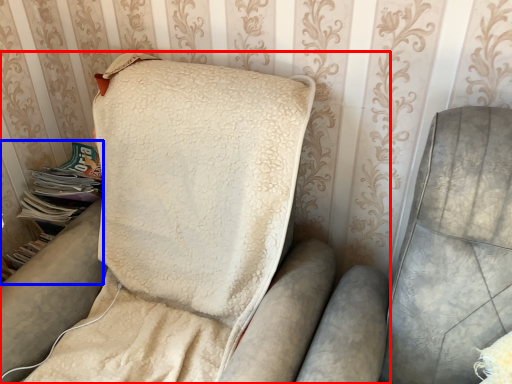
Question: Which point is further to the camera, furniture (highlighted by a red box) or magazine (highlighted by a blue box)?

Choices:
 (A) furniture
 (B) magazine

Answer: (B)